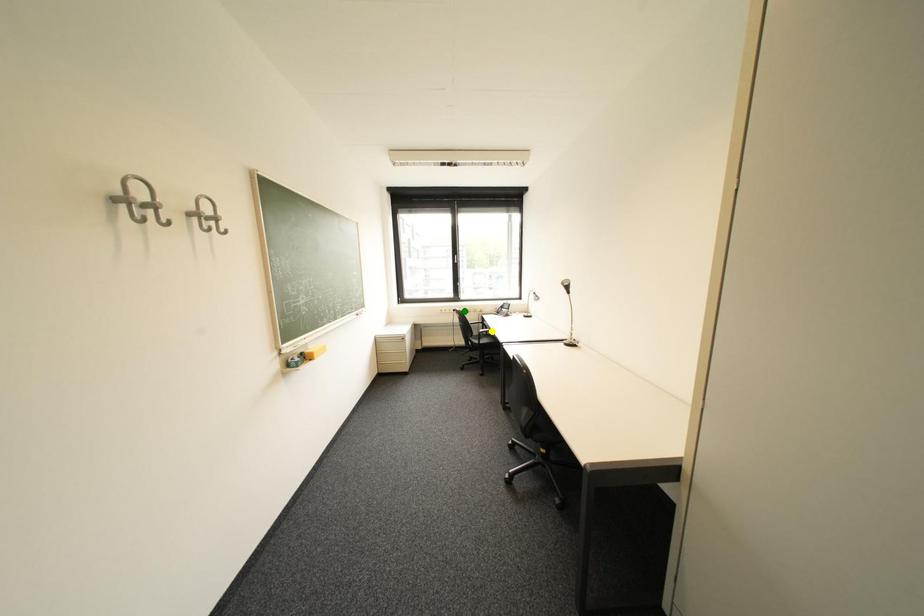
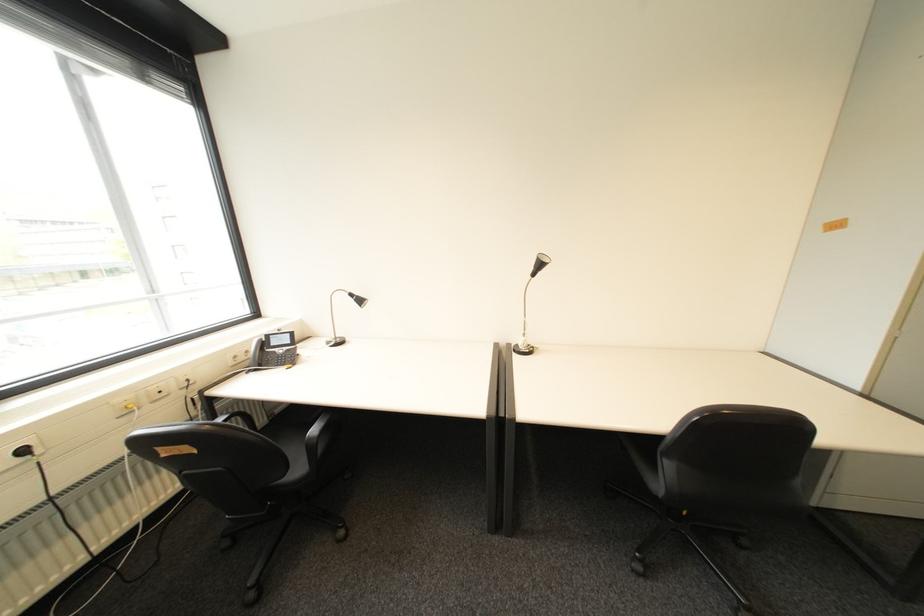
I am providing you with two images of the same scene from different viewpoints. Three points are marked in image1. Which point corresponds to a part or object that is occluded in image2?In image1, three points are marked. Which of them correspond to a part or object that is occluded in image2?Among the three points shown in image1, which one corresponds to a part or object that is no longer visible due to occlusion in image2?

Invisible in image2: yellow point.